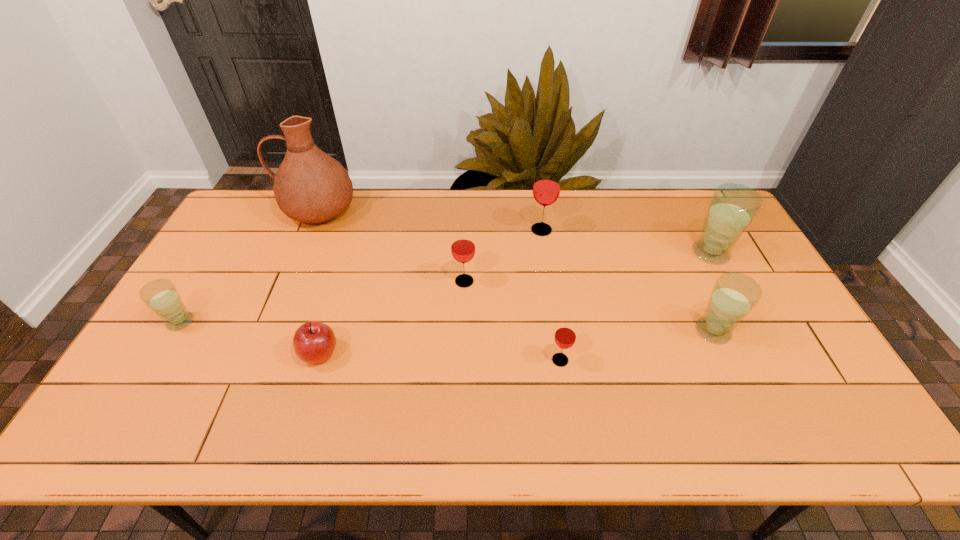
In order to click on the leftmost glass in this screenshot , I will do `click(160, 295)`.

Find the location of a particular element. This screenshot has width=960, height=540. the smallest blue glass is located at coordinates (160, 295).

The image size is (960, 540). I want to click on apple, so click(x=314, y=342).

Locate an element on the screen. pink apple is located at coordinates (314, 342).

Locate an element on the screen. Image resolution: width=960 pixels, height=540 pixels. vacant space situated on the side of the pitcher with the handle is located at coordinates (260, 211).

Locate an element on the screen. free space located on the left of the biggest red glass is located at coordinates (496, 230).

Where is `vacant space located on the back of the farthest blue glass`? vacant space located on the back of the farthest blue glass is located at coordinates (697, 228).

In order to click on vacant region located on the front of the third farthest glass in this screenshot , I will do `click(460, 401)`.

In order to click on vacant region located on the left of the second smallest blue glass in this screenshot , I will do `click(660, 331)`.

At what (x,y) coordinates should I click in order to perform the action: click on free space located 0.070m on the front of the smallest red glass. Please return your answer as a coordinate pair (x, y). The height and width of the screenshot is (540, 960). Looking at the image, I should click on (565, 394).